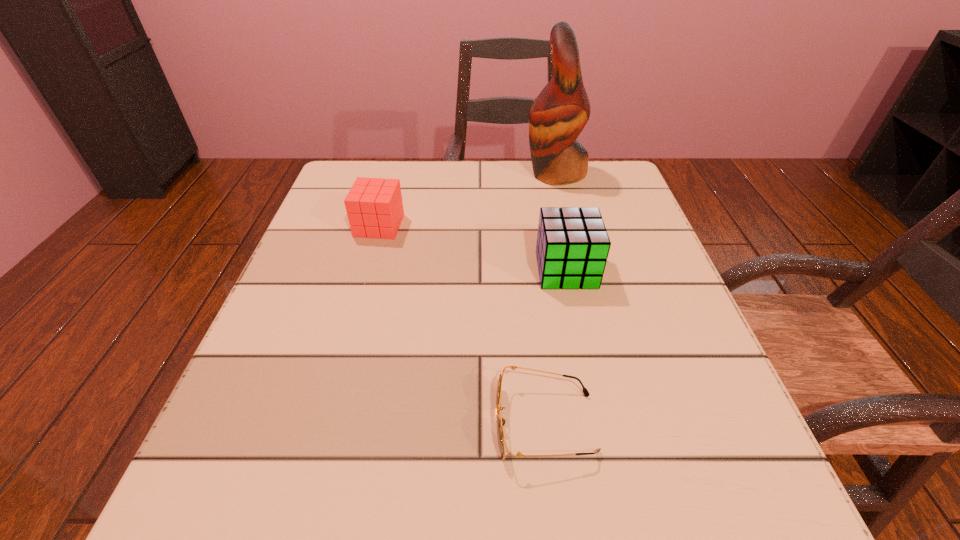
This screenshot has width=960, height=540. In the image, there is a desktop. Find the location of `free space at the far right corner`. free space at the far right corner is located at coordinates (584, 202).

You are a GUI agent. You are given a task and a screenshot of the screen. Output one action in this format:
    pyautogui.click(x=<x>, y=<y>)
    Task: Click on the empty space that is in between the farther cube and the nearer cube
    The height and width of the screenshot is (540, 960).
    Given the screenshot: What is the action you would take?
    pos(472,248)

You are a GUI agent. You are given a task and a screenshot of the screen. Output one action in this format:
    pyautogui.click(x=<x>, y=<y>)
    Task: Click on the free space between the third nearest object and the shortest object
    The image size is (960, 540).
    Given the screenshot: What is the action you would take?
    pyautogui.click(x=462, y=325)

Find the location of a particular element. vacant space in between the taller cube and the shorter cube is located at coordinates (472, 248).

Identify the location of blank region between the taller cube and the left cube. This screenshot has width=960, height=540. (472, 248).

The height and width of the screenshot is (540, 960). What are the coordinates of `vacant area that lies between the nearest object and the farthest object` in the screenshot? It's located at (550, 298).

Locate an element on the screen. vacant space in between the nearest object and the third tallest object is located at coordinates (462, 325).

I want to click on unoccupied position between the nearest object and the third nearest object, so click(462, 325).

Where is `free space between the right cube and the second shortest object`? Image resolution: width=960 pixels, height=540 pixels. free space between the right cube and the second shortest object is located at coordinates (472, 248).

The image size is (960, 540). Identify the location of blank region between the shortest object and the third shortest object. (556, 347).